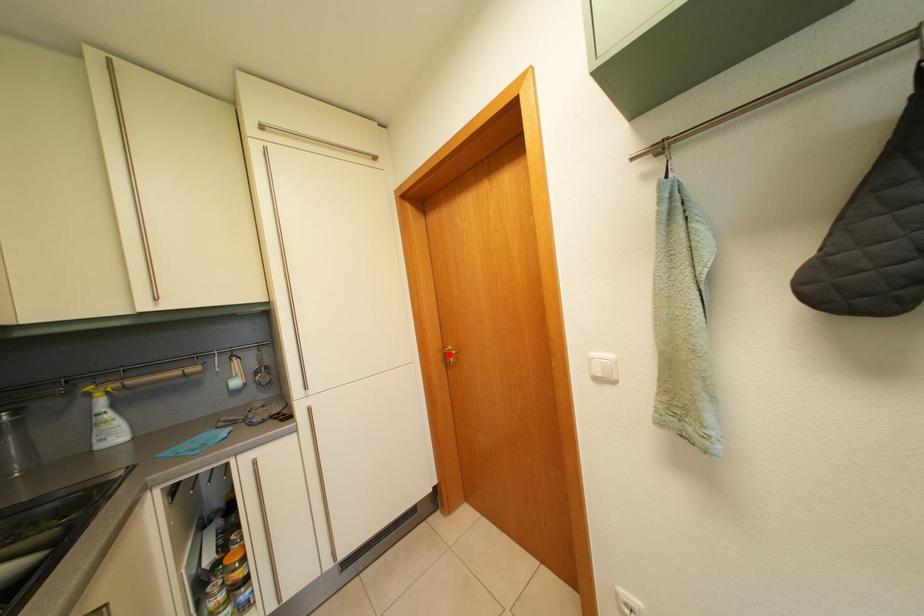
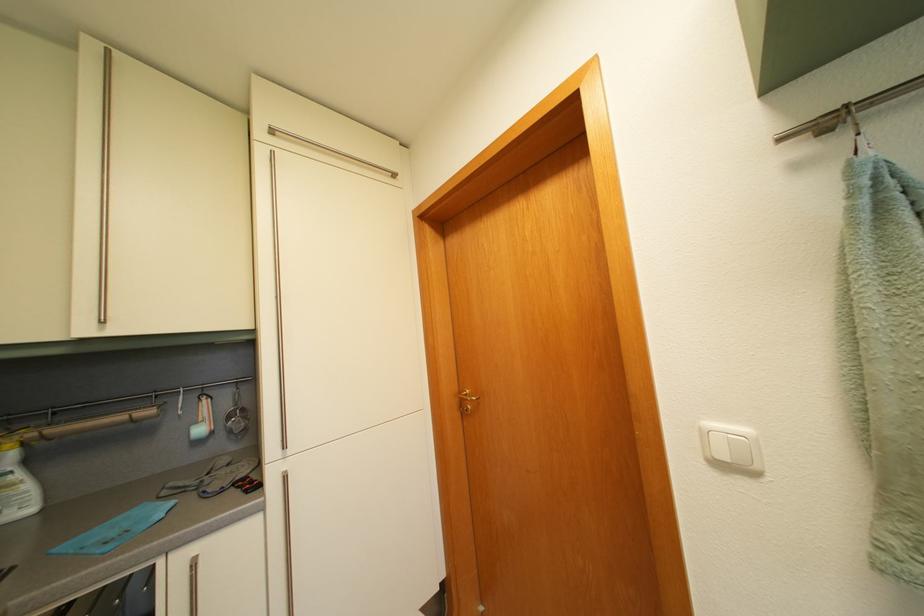
Find the pixel in the second image that matches the highlighted location in the first image.

(465, 397)